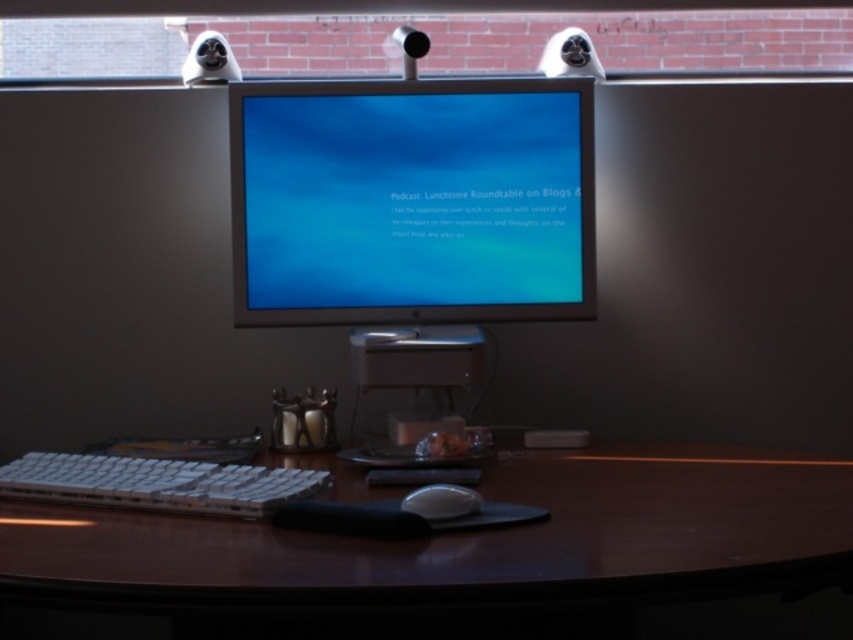
Does point (558, 179) lie in front of point (86, 483)?

That is False.

Can you confirm if satin silver monitor at center is bigger than white plastic keyboard at lower left?

Yes, satin silver monitor at center is bigger than white plastic keyboard at lower left.

What do you see at coordinates (410, 202) in the screenshot? This screenshot has width=853, height=640. I see `satin silver monitor at center` at bounding box center [410, 202].

This screenshot has height=640, width=853. I want to click on satin silver monitor at center, so click(410, 202).

Is brown wood table at center below white matte mouse at center?

Yes.

Which is above, brown wood table at center or white matte mouse at center?

Result: Positioned higher is white matte mouse at center.

Where is `brown wood table at center`? brown wood table at center is located at coordinates (471, 557).

Is brown wood table at center further to the viewer compared to satin silver monitor at center?

No.

Does brown wood table at center have a lesser height compared to satin silver monitor at center?

Yes, brown wood table at center is shorter than satin silver monitor at center.

Between point (389, 490) and point (473, 257), which one is positioned behind?

Point (473, 257)

Where is `brown wood table at center`? brown wood table at center is located at coordinates (471, 557).